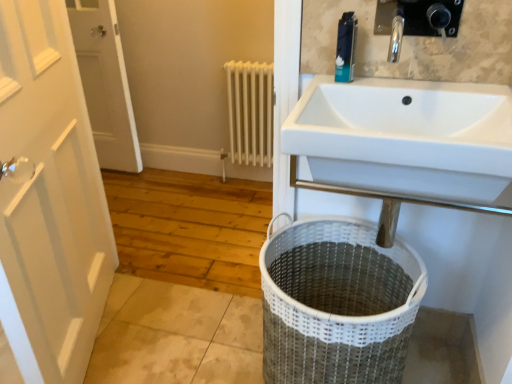
The width and height of the screenshot is (512, 384). In order to click on free space to the left of white woven laundry basket at lower center in this screenshot , I will do `click(213, 349)`.